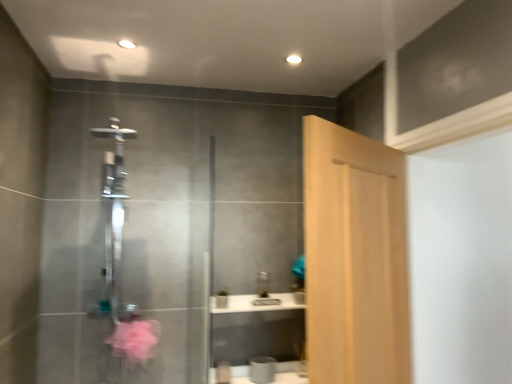
Question: From a real-world perspective, relative to clear glass shower at center, is light wood door at center vertically above or below?

Choices:
 (A) below
 (B) above

Answer: (A)

Question: Which is correct: light wood door at center is inside clear glass shower at center, or outside of it?

Choices:
 (A) inside
 (B) outside

Answer: (B)

Question: Considering their positions, is light wood door at center located in front of or behind clear glass shower at center?

Choices:
 (A) behind
 (B) front

Answer: (B)

Question: Based on their sizes in the image, would you say clear glass shower at center is bigger or smaller than light wood door at center?

Choices:
 (A) small
 (B) big

Answer: (A)

Question: From a real-world perspective, is clear glass shower at center positioned above or below light wood door at center?

Choices:
 (A) below
 (B) above

Answer: (B)

Question: In terms of width, does clear glass shower at center look wider or thinner when compared to light wood door at center?

Choices:
 (A) thin
 (B) wide

Answer: (B)

Question: Is clear glass shower at center taller or shorter than light wood door at center?

Choices:
 (A) tall
 (B) short

Answer: (A)